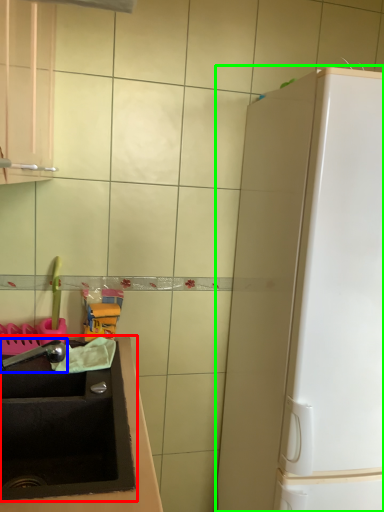
Question: Considering the real-world distances, which object is closest to sink (highlighted by a red box)? faucet (highlighted by a blue box) or appliance (highlighted by a green box).

Choices:
 (A) faucet
 (B) appliance

Answer: (A)